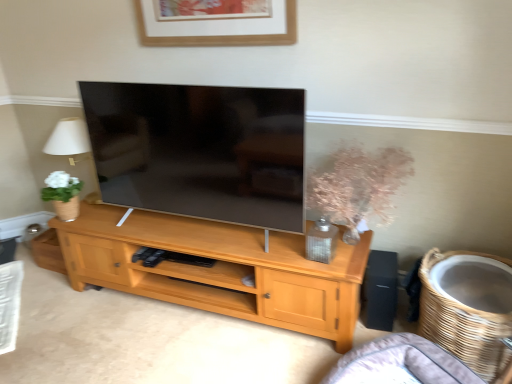
Question: Is light wood cabinet at center facing away from translucent glass vase at center-right?

Choices:
 (A) yes
 (B) no

Answer: (B)

Question: Is light wood cabinet at center aimed at translucent glass vase at center-right?

Choices:
 (A) yes
 (B) no

Answer: (B)

Question: Considering the relative sizes of light wood cabinet at center and translucent glass vase at center-right in the image provided, is light wood cabinet at center smaller than translucent glass vase at center-right?

Choices:
 (A) no
 (B) yes

Answer: (A)

Question: From a real-world perspective, is light wood cabinet at center over translucent glass vase at center-right?

Choices:
 (A) no
 (B) yes

Answer: (A)

Question: Can you confirm if light wood cabinet at center is shorter than translucent glass vase at center-right?

Choices:
 (A) no
 (B) yes

Answer: (B)

Question: Is black matte speaker at right wider or thinner than gray fabric couch at lower right?

Choices:
 (A) wide
 (B) thin

Answer: (B)

Question: Considering the positions of point (368, 312) and point (361, 350), is point (368, 312) closer or farther from the camera than point (361, 350)?

Choices:
 (A) closer
 (B) farther

Answer: (B)

Question: From the image's perspective, is black matte speaker at right above or below gray fabric couch at lower right?

Choices:
 (A) above
 (B) below

Answer: (A)

Question: In terms of size, does black matte speaker at right appear bigger or smaller than gray fabric couch at lower right?

Choices:
 (A) big
 (B) small

Answer: (B)

Question: Is translucent glass vase at center-right inside the boundaries of black matte speaker at right, or outside?

Choices:
 (A) inside
 (B) outside

Answer: (B)

Question: From their relative heights in the image, would you say translucent glass vase at center-right is taller or shorter than black matte speaker at right?

Choices:
 (A) tall
 (B) short

Answer: (A)

Question: Is translucent glass vase at center-right wider or thinner than black matte speaker at right?

Choices:
 (A) wide
 (B) thin

Answer: (A)

Question: In the image, is translucent glass vase at center-right positioned in front of or behind black matte speaker at right?

Choices:
 (A) front
 (B) behind

Answer: (A)

Question: Would you say wooden picture frame at upper center is to the left or to the right of light wood cabinet at center in the picture?

Choices:
 (A) left
 (B) right

Answer: (B)

Question: From the image's perspective, is wooden picture frame at upper center above or below light wood cabinet at center?

Choices:
 (A) above
 (B) below

Answer: (A)